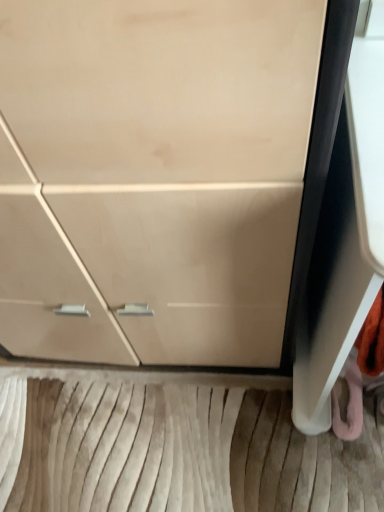
Identify the location of matte wood chest of drawers at center. This screenshot has width=384, height=512. (153, 177).

The height and width of the screenshot is (512, 384). Describe the element at coordinates (153, 177) in the screenshot. I see `matte wood chest of drawers at center` at that location.

Where is `matte wood chest of drawers at center`? The image size is (384, 512). matte wood chest of drawers at center is located at coordinates (153, 177).